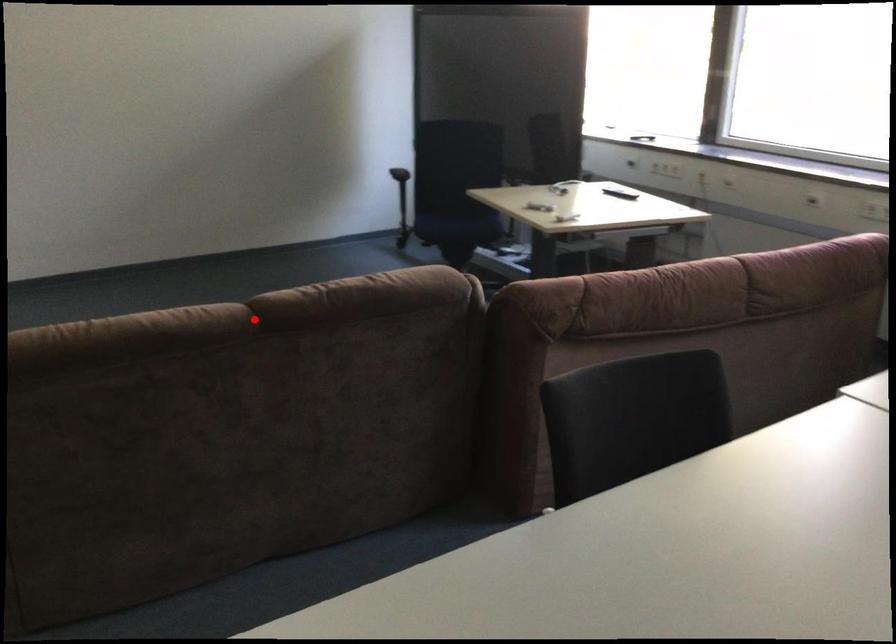
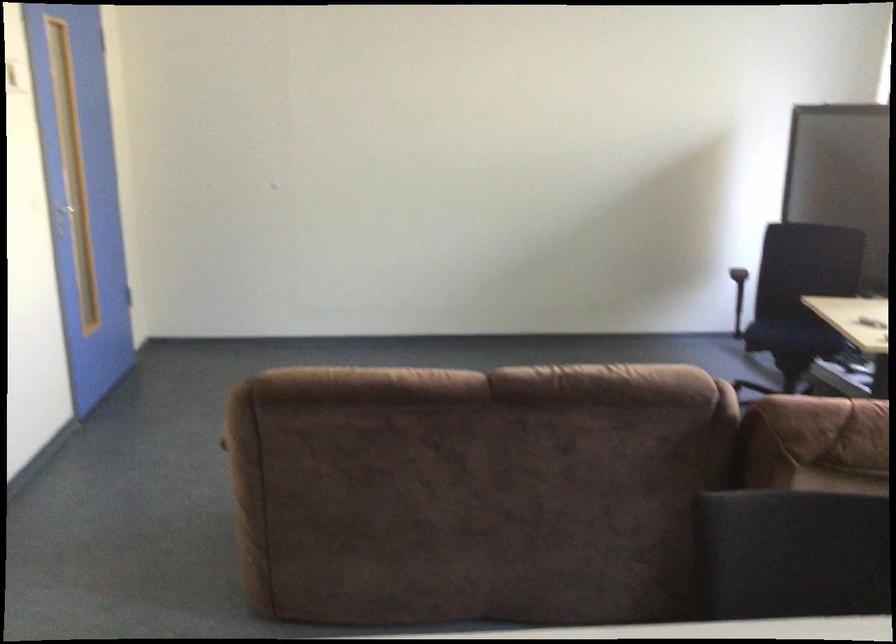
Question: I am providing you with two images of the same scene from different viewpoints. A red point is shown in image1. For the corresponding object point in image2, is it positioned nearer or farther from the camera?

Choices:
 (A) Nearer
 (B) Farther

Answer: (B)